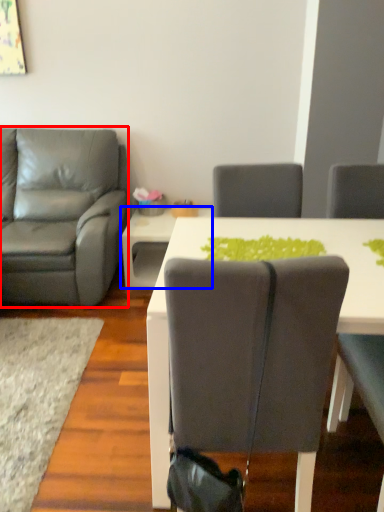
Question: Which point is further to the camera, chair (highlighted by a red box) or table (highlighted by a blue box)?

Choices:
 (A) chair
 (B) table

Answer: (B)